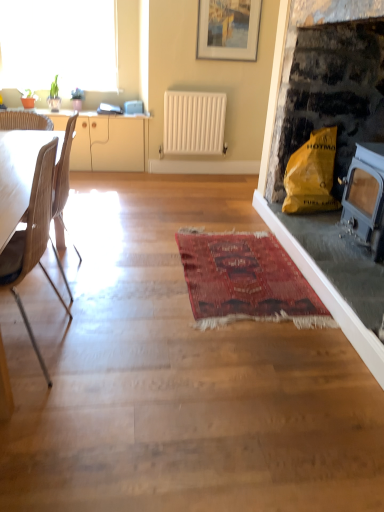
Where is `vacant region to the right of wooden chair at left, which is the 2th chair from back to front`? This screenshot has height=512, width=384. vacant region to the right of wooden chair at left, which is the 2th chair from back to front is located at coordinates (124, 351).